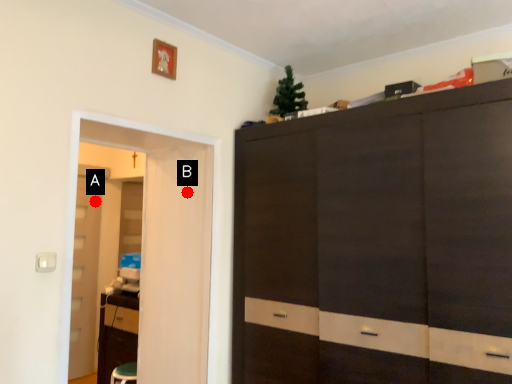
Question: Two points are circled on the image, labeled by A and B beside each circle. Which of the following is the farthest from the observer?

Choices:
 (A) A is further
 (B) B is further

Answer: (A)